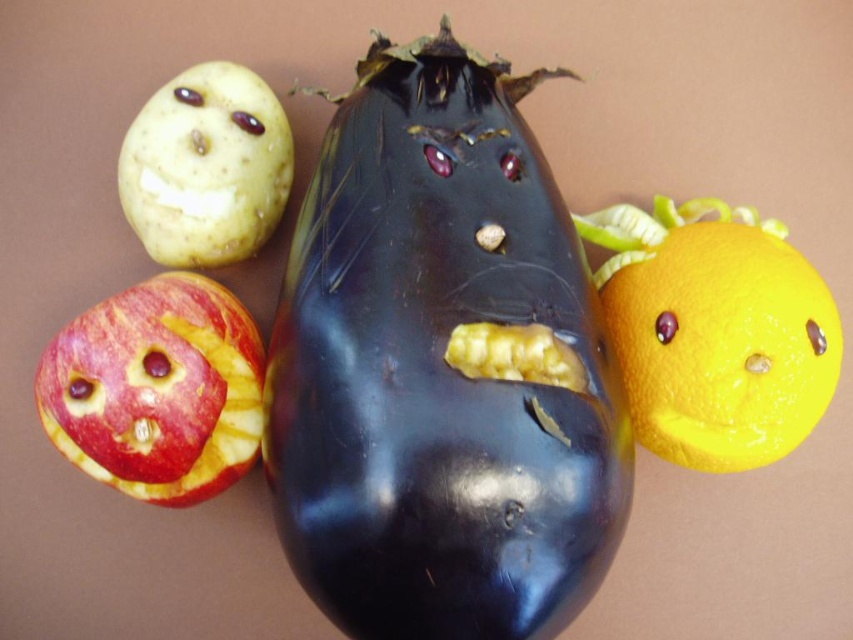
Question: In this image, where is shiny dark purple eggplant at center located relative to yellow matte/orange at right?

Choices:
 (A) below
 (B) above

Answer: (B)

Question: Which point is farther to the camera?

Choices:
 (A) yellow matte potato at upper left
 (B) shiny dark purple eggplant at center
 (C) smooth red apple at lower left

Answer: (A)

Question: Among these objects, which one is nearest to the camera?

Choices:
 (A) smooth red apple at lower left
 (B) shiny dark purple eggplant at center

Answer: (B)

Question: Does smooth red apple at lower left have a greater width compared to yellow matte potato at upper left?

Choices:
 (A) no
 (B) yes

Answer: (B)

Question: Which point is closer to the camera?

Choices:
 (A) (646, 428)
 (B) (224, 204)
 (C) (88, 384)
 (D) (268, 385)

Answer: (C)

Question: Does yellow matte/orange at right have a greater width compared to smooth red apple at lower left?

Choices:
 (A) yes
 (B) no

Answer: (A)